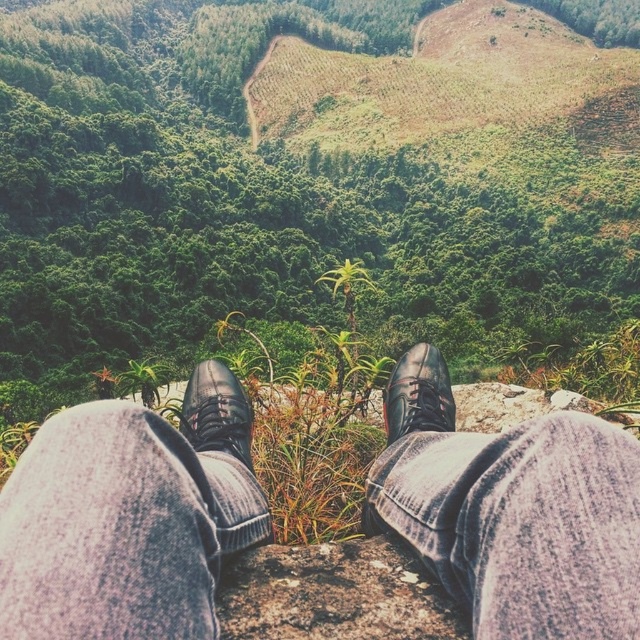
Where is `black leather shoe at center`? This screenshot has width=640, height=640. black leather shoe at center is located at coordinates (216, 412).

Is black leather shoe at center closer to the viewer compared to shiny black shoe at center?

Yes, black leather shoe at center is closer to the viewer.

Is point (216, 376) positioned in front of point (419, 401)?

No, (216, 376) is further to viewer.

You are a GUI agent. You are given a task and a screenshot of the screen. Output one action in this format:
    pyautogui.click(x=<x>, y=<y>)
    Task: Click on the black leather shoe at center
    The width and height of the screenshot is (640, 640).
    Given the screenshot: What is the action you would take?
    pyautogui.click(x=216, y=412)

Is denim pants at lower center shorter than shiny black shoe at center?

No.

Is point (200, 584) farther from camera compared to point (394, 412)?

No, (200, 584) is in front of (394, 412).

What are the coordinates of `denim pants at lower center` in the screenshot? It's located at (129, 516).

At what (x,y) coordinates should I click in order to perform the action: click on green leafy vegetation at center. Please return your answer as a coordinate pair (x, y). Looking at the image, I should click on (x=307, y=173).

Which is more to the right, green leafy vegetation at center or denim pants at lower center?

denim pants at lower center is more to the right.

Who is more forward, (150, 100) or (452, 461)?

Point (452, 461) is in front.

Locate an element on the screen. green leafy vegetation at center is located at coordinates (307, 173).